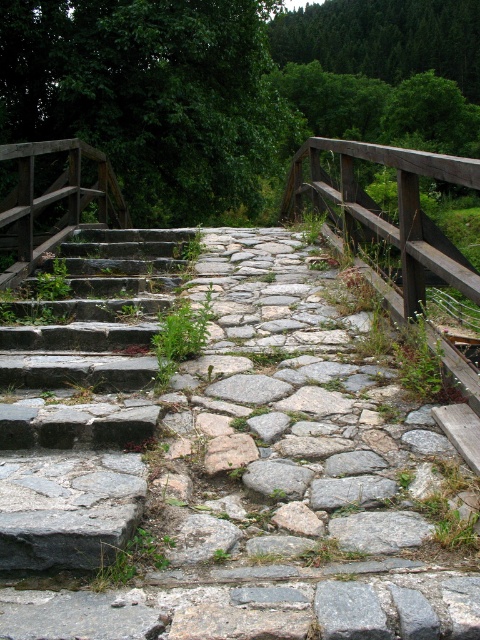
Can you confirm if wooden planks at left is bigger than gray rough stone at center?

Correct, wooden planks at left is larger in size than gray rough stone at center.

Is wooden planks at left smaller than gray rough stone at center?

Incorrect, wooden planks at left is not smaller in size than gray rough stone at center.

Does point (80, 148) come farther from viewer compared to point (272, 486)?

Yes, it is.

Locate an element on the screen. wooden planks at left is located at coordinates (56, 198).

Can you confirm if wooden rail at center is smaller than wooden planks at left?

Actually, wooden rail at center might be larger than wooden planks at left.

What do you see at coordinates (384, 214) in the screenshot?
I see `wooden rail at center` at bounding box center [384, 214].

The height and width of the screenshot is (640, 480). I want to click on wooden rail at center, so click(x=384, y=214).

Describe the element at coordinates (222, 458) in the screenshot. I see `gray stone path at center` at that location.

Does point (225, 416) lie in front of point (72, 212)?

Yes, it is.

You are a GUI agent. You are given a task and a screenshot of the screen. Output one action in this format:
    pyautogui.click(x=<x>, y=<y>)
    Task: Click on the gray stone path at center
    
    Given the screenshot: What is the action you would take?
    pyautogui.click(x=222, y=458)